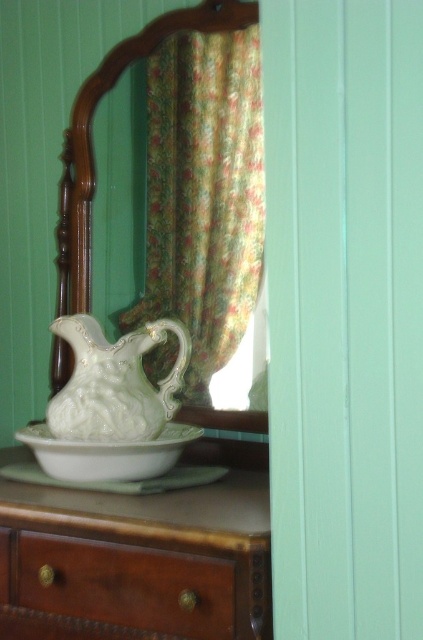
Question: From the image, what is the correct spatial relationship of wooden drawer at lower left in relation to white porcelain pitcher at center?

Choices:
 (A) below
 (B) above

Answer: (A)

Question: Which point appears farthest from the camera in this image?

Choices:
 (A) (132, 442)
 (B) (104, 403)
 (C) (13, 541)

Answer: (B)

Question: Among these points, which one is nearest to the camera?

Choices:
 (A) (216, 612)
 (B) (129, 548)
 (C) (151, 424)

Answer: (A)

Question: Does matte white porcelain at center appear on the right side of wooden drawer at lower left?

Choices:
 (A) no
 (B) yes

Answer: (B)

Question: Can you confirm if wooden drawer at lower left is positioned below white glossy plate at center?

Choices:
 (A) no
 (B) yes

Answer: (B)

Question: Which point is farther to the camera?

Choices:
 (A) floral fabric curtain at upper center
 (B) white glossy plate at center
 (C) wooden drawer at lower left

Answer: (A)